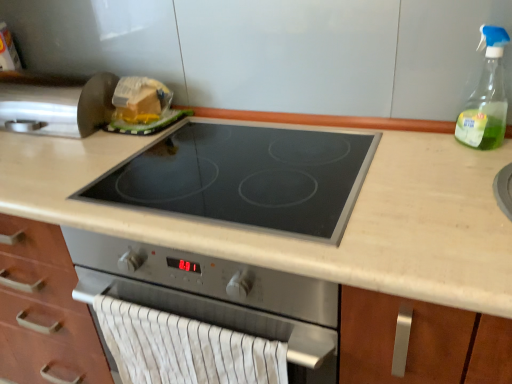
This screenshot has width=512, height=384. Identify the location of free area in between metallic silver knife at upper left and clear glass spray bottle at upper right. (282, 137).